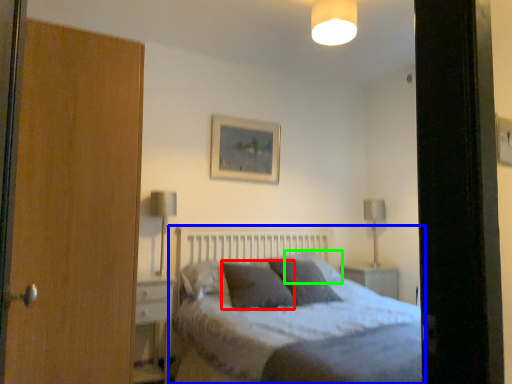
Question: Which object is the farthest from pillow (highlighted by a red box)? Choose among these: bed (highlighted by a blue box) or pillow (highlighted by a green box).

Choices:
 (A) bed
 (B) pillow

Answer: (B)